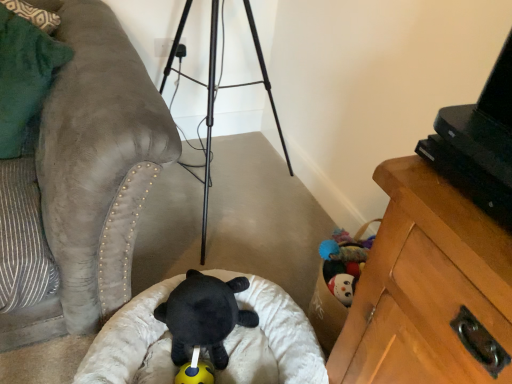
Question: Is green suede pillow at left located within yellow rubber ball at center, placed as the second toy when sorted from top to bottom?

Choices:
 (A) no
 (B) yes

Answer: (A)

Question: Is yellow rubber ball at center, placed as the 1th toy when sorted from bottom to top, positioned far away from green suede pillow at left?

Choices:
 (A) no
 (B) yes

Answer: (A)

Question: Considering the relative sizes of yellow rubber ball at center, placed as the second toy when sorted from top to bottom, and green suede pillow at left in the image provided, is yellow rubber ball at center, placed as the second toy when sorted from top to bottom, shorter than green suede pillow at left?

Choices:
 (A) no
 (B) yes

Answer: (B)

Question: Is yellow rubber ball at center, placed as the 1th toy when sorted from bottom to top, behind green suede pillow at left?

Choices:
 (A) yes
 (B) no

Answer: (A)

Question: Is yellow rubber ball at center, placed as the second toy when sorted from top to bottom, next to green suede pillow at left?

Choices:
 (A) no
 (B) yes

Answer: (A)

Question: Can you confirm if yellow rubber ball at center, placed as the 1th toy when sorted from bottom to top, is taller than green suede pillow at left?

Choices:
 (A) yes
 (B) no

Answer: (B)

Question: Is green suede pillow at left smaller than black plush bear at center, which appears as the 2th toy when ordered from the bottom?

Choices:
 (A) yes
 (B) no

Answer: (B)

Question: Can you confirm if green suede pillow at left is positioned to the left of black plush bear at center, the 1th toy from the top?

Choices:
 (A) no
 (B) yes

Answer: (B)

Question: Is the surface of green suede pillow at left in direct contact with black plush bear at center, which appears as the 2th toy when ordered from the bottom?

Choices:
 (A) yes
 (B) no

Answer: (B)

Question: From the image's perspective, is green suede pillow at left beneath black plush bear at center, which appears as the 2th toy when ordered from the bottom?

Choices:
 (A) yes
 (B) no

Answer: (B)

Question: Is green suede pillow at left taller than black plush bear at center, the 1th toy from the top?

Choices:
 (A) yes
 (B) no

Answer: (A)

Question: Is green suede pillow at left closer to camera compared to black plush bear at center, the 1th toy from the top?

Choices:
 (A) no
 (B) yes

Answer: (B)

Question: From the image's perspective, is black plastic tv at upper right under black plush bear at center, which appears as the 2th toy when ordered from the bottom?

Choices:
 (A) yes
 (B) no

Answer: (B)